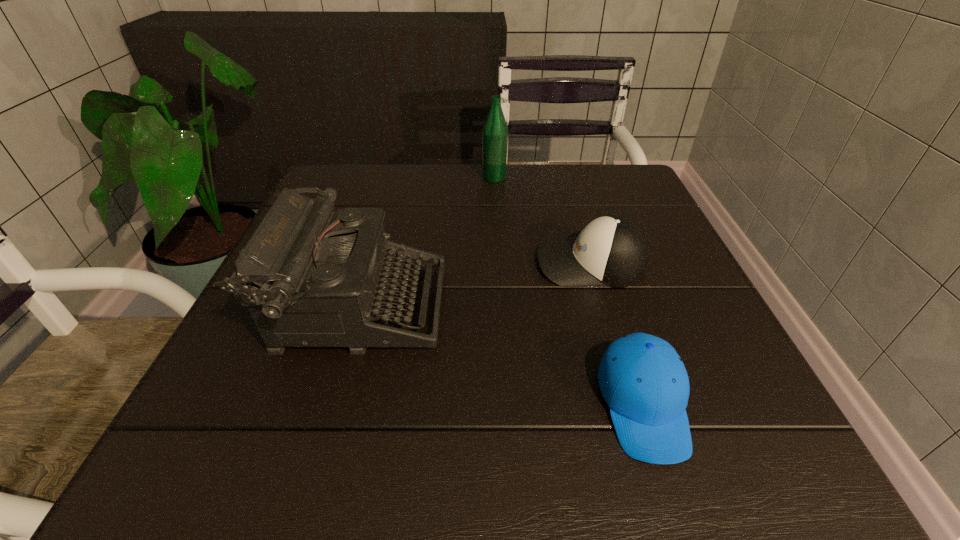
Locate an element on the screen. This screenshot has width=960, height=540. blank space located on the front panel of the farther cap is located at coordinates (362, 264).

The height and width of the screenshot is (540, 960). I want to click on blank area located 0.060m on the front panel of the farther cap, so click(x=507, y=264).

Locate an element on the screen. object that is at the far edge is located at coordinates (495, 131).

Locate an element on the screen. object that is positioned at the near edge is located at coordinates (643, 380).

Find the location of a particular element. object that is at the left edge is located at coordinates (317, 277).

Find the location of `object that is at the near right corner`. object that is at the near right corner is located at coordinates (643, 380).

The image size is (960, 540). I want to click on vacant space at the far edge of the desktop, so click(x=426, y=168).

Locate an element on the screen. The image size is (960, 540). vacant space at the near edge of the desktop is located at coordinates (409, 442).

This screenshot has height=540, width=960. Identify the location of vacant space at the right edge. (708, 405).

The height and width of the screenshot is (540, 960). I want to click on vacant area at the far left corner, so click(x=337, y=209).